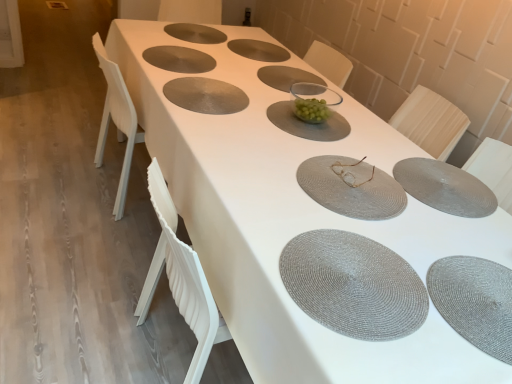
This screenshot has height=384, width=512. Identify the location of free space above gray woven placemat at center, the 8th tableware positioned from the top (from a real-world perspective). (439, 180).